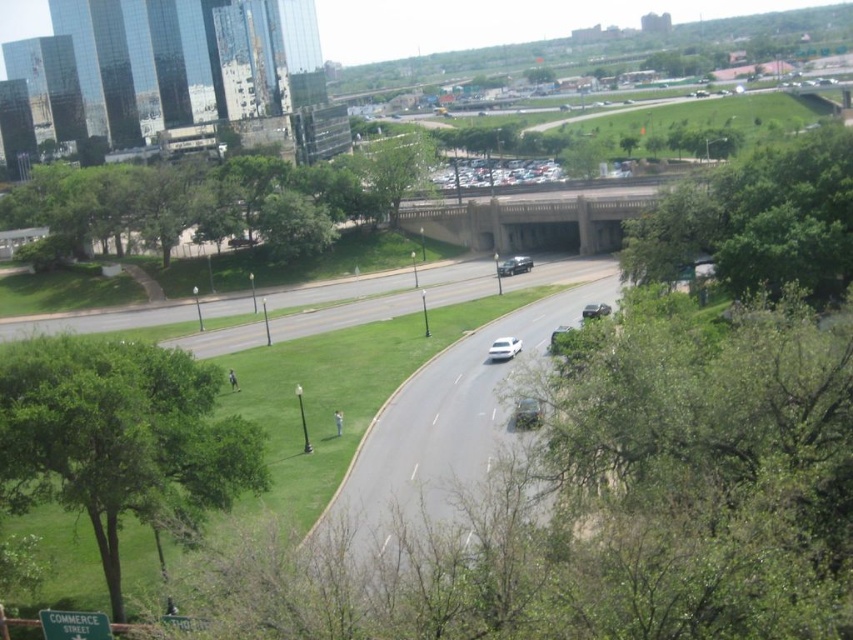
Question: In this image, where is white glossy sedan at center located relative to metallic silver sedan at center?

Choices:
 (A) left
 (B) right

Answer: (A)

Question: Can you confirm if green leafy tree at upper left is positioned below green leafy tree at center?

Choices:
 (A) yes
 (B) no

Answer: (A)

Question: Considering the real-world distances, which object is farthest from the green leafy tree at upper center?

Choices:
 (A) green leafy tree at upper right
 (B) green leafy tree at center
 (C) white glossy sedan at center

Answer: (C)

Question: Estimate the real-world distances between objects in this image. Which object is farther from the concrete bridge at center?

Choices:
 (A) green leafy tree at upper center
 (B) green leafy tree at upper left
 (C) green leafy tree at lower left
 (D) green leafy tree at upper right

Answer: (A)

Question: Considering the real-world distances, which object is farthest from the white glossy sedan at center?

Choices:
 (A) green leafy tree at lower left
 (B) green leafy tree at upper center
 (C) concrete bridge at center

Answer: (B)

Question: From the image, what is the correct spatial relationship of concrete bridge at center in relation to white glossy sedan at center?

Choices:
 (A) above
 (B) below

Answer: (A)